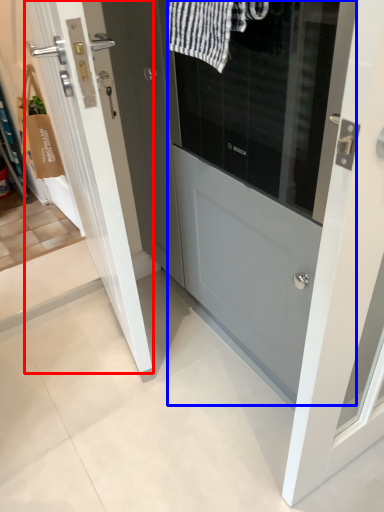
Question: Which of the following is the closest to the observer, door (highlighted by a red box) or door (highlighted by a blue box)?

Choices:
 (A) door
 (B) door

Answer: (B)